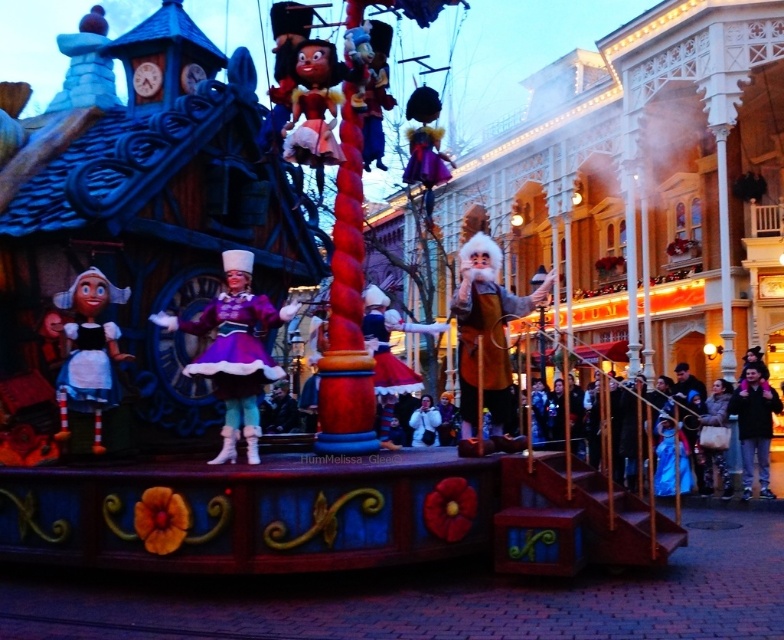
Question: Which of the following is the closest to the observer?

Choices:
 (A) matte purple fabric dress at center
 (B) brown woolen coat at center
 (C) black leather jacket at lower right

Answer: (A)

Question: Where is matte purple fabric dress at center located in relation to black leather jacket at lower right in the image?

Choices:
 (A) right
 (B) left

Answer: (B)

Question: Can you confirm if black leather jacket at lower right is bigger than white fluffy coat at center?

Choices:
 (A) yes
 (B) no

Answer: (A)

Question: Considering the real-world distances, which object is closest to the matte purple fabric dress at center?

Choices:
 (A) white fluffy coat at center
 (B) black leather jacket at lower right

Answer: (B)

Question: Which point is farther to the camera?

Choices:
 (A) white fluffy coat at center
 (B) matte white fabric doll at left
 (C) black leather jacket at lower right

Answer: (A)

Question: Can you confirm if matte white fabric doll at left is positioned above white fluffy coat at center?

Choices:
 (A) yes
 (B) no

Answer: (A)